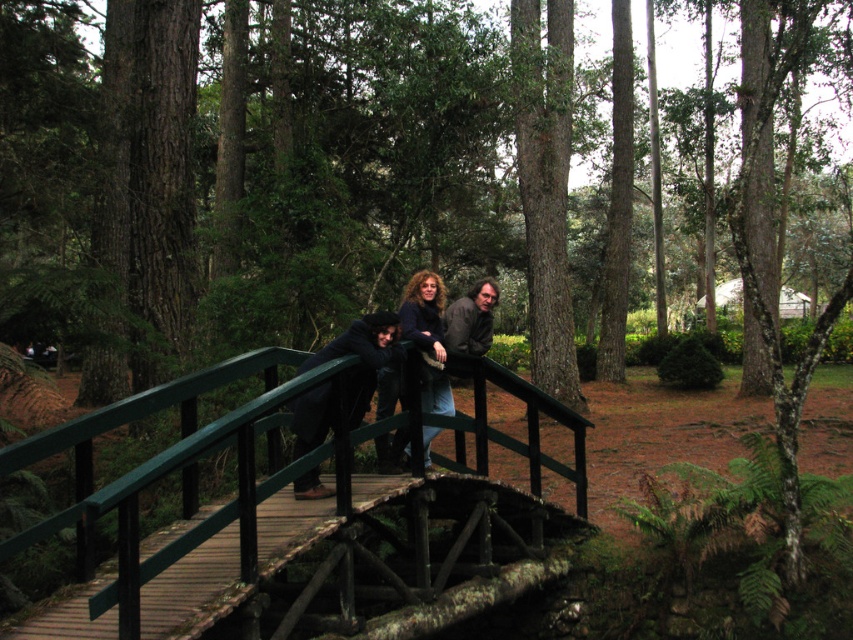
Which is more to the right, green wooden bridge at center or matte black jacket at center?

From the viewer's perspective, matte black jacket at center appears more on the right side.

Does green wooden bridge at center appear over matte black jacket at center?

No, green wooden bridge at center is not above matte black jacket at center.

Describe the element at coordinates (306, 518) in the screenshot. The width and height of the screenshot is (853, 640). I see `green wooden bridge at center` at that location.

You are a GUI agent. You are given a task and a screenshot of the screen. Output one action in this format:
    pyautogui.click(x=<x>, y=<y>)
    Task: Click on the green wooden bridge at center
    
    Given the screenshot: What is the action you would take?
    pyautogui.click(x=306, y=518)

Is dark blue jacket at center above dark blue sweater at center?

Correct, dark blue jacket at center is located above dark blue sweater at center.

Is point (361, 410) farther from viewer compared to point (433, 349)?

No.

At what (x,y) coordinates should I click in order to perform the action: click on dark blue jacket at center. Please return your answer as a coordinate pair (x, y). Looking at the image, I should click on (361, 358).

Who is shorter, matte black jacket at center or dark blue sweater at center?

With less height is matte black jacket at center.

Locate an element on the screen. This screenshot has width=853, height=640. matte black jacket at center is located at coordinates (444, 330).

Who is more forward, (425, 298) or (422, 276)?

Positioned in front is point (425, 298).

Where is `matte black jacket at center`? matte black jacket at center is located at coordinates (444, 330).